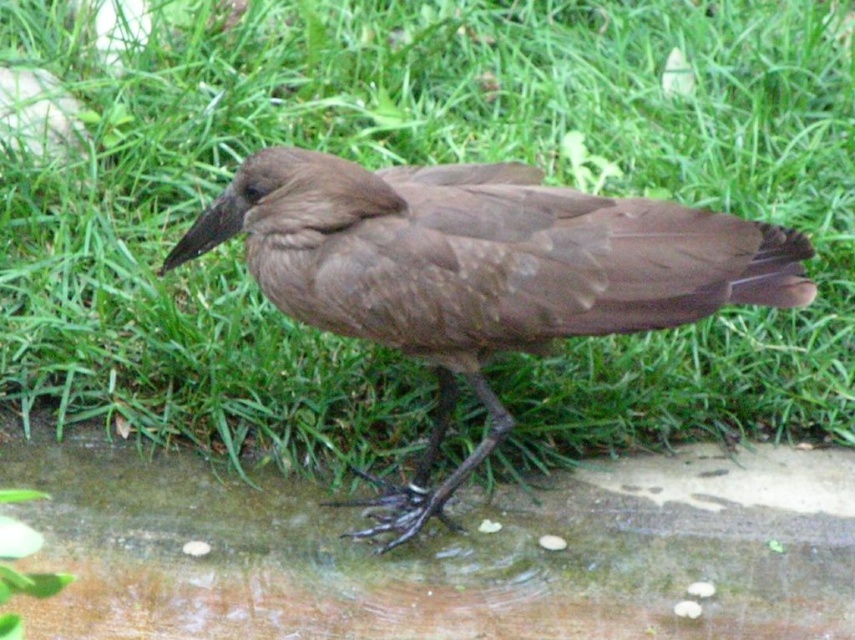
Does green grass at center appear over brown matte bird at center?

Indeed, green grass at center is positioned over brown matte bird at center.

Which is behind, point (289, 394) or point (647, 250)?

Point (289, 394)

Where is `green grass at center`? The width and height of the screenshot is (855, 640). green grass at center is located at coordinates (423, 161).

Find the location of a particular element. The width and height of the screenshot is (855, 640). green grass at center is located at coordinates (423, 161).

Is brown glossy puddle at lower center below brown matte bird at center?

Correct, brown glossy puddle at lower center is located below brown matte bird at center.

Can you confirm if brown glossy puddle at lower center is positioned to the left of brown matte bird at center?

Correct, you'll find brown glossy puddle at lower center to the left of brown matte bird at center.

Describe the element at coordinates (445, 552) in the screenshot. I see `brown glossy puddle at lower center` at that location.

You are a GUI agent. You are given a task and a screenshot of the screen. Output one action in this format:
    pyautogui.click(x=<x>, y=<y>)
    Task: Click on the brown glossy puddle at lower center
    The height and width of the screenshot is (640, 855).
    Given the screenshot: What is the action you would take?
    pyautogui.click(x=445, y=552)

The height and width of the screenshot is (640, 855). Describe the element at coordinates (423, 161) in the screenshot. I see `green grass at center` at that location.

Is green grass at center bigger than brown glossy puddle at lower center?

Yes.

The image size is (855, 640). Find the location of `green grass at center`. green grass at center is located at coordinates (423, 161).